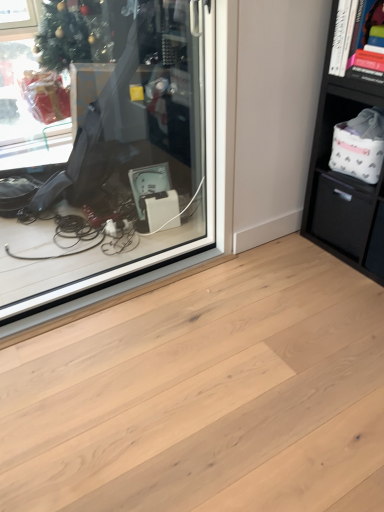
Question: Is transparent glass shop window at center at the left side of natural wood plank at center?

Choices:
 (A) no
 (B) yes

Answer: (B)

Question: Is transparent glass shop window at center not close to natural wood plank at center?

Choices:
 (A) no
 (B) yes

Answer: (A)

Question: Can you confirm if transparent glass shop window at center is positioned to the right of natural wood plank at center?

Choices:
 (A) yes
 (B) no

Answer: (B)

Question: From the image's perspective, does transparent glass shop window at center appear lower than natural wood plank at center?

Choices:
 (A) yes
 (B) no

Answer: (B)

Question: From a real-world perspective, is transparent glass shop window at center beneath natural wood plank at center?

Choices:
 (A) yes
 (B) no

Answer: (B)

Question: Considering the positions of black matte drawer at right and natural wood plank at center in the image, is black matte drawer at right bigger or smaller than natural wood plank at center?

Choices:
 (A) small
 (B) big

Answer: (A)

Question: From the image's perspective, relative to natural wood plank at center, is black matte drawer at right above or below?

Choices:
 (A) above
 (B) below

Answer: (A)

Question: Looking at their shapes, would you say black matte drawer at right is wider or thinner than natural wood plank at center?

Choices:
 (A) wide
 (B) thin

Answer: (B)

Question: Is black matte drawer at right to the left or to the right of natural wood plank at center in the image?

Choices:
 (A) right
 (B) left

Answer: (A)

Question: Does point pyautogui.click(x=370, y=74) appear closer or farther from the camera than point pyautogui.click(x=281, y=330)?

Choices:
 (A) closer
 (B) farther

Answer: (A)

Question: Considering their positions, is black matte bookshelf at upper right located in front of or behind natural wood plank at center?

Choices:
 (A) front
 (B) behind

Answer: (B)

Question: Is black matte bookshelf at upper right to the left or to the right of natural wood plank at center in the image?

Choices:
 (A) right
 (B) left

Answer: (A)

Question: Looking at their shapes, would you say black matte bookshelf at upper right is wider or thinner than natural wood plank at center?

Choices:
 (A) thin
 (B) wide

Answer: (A)

Question: Considering the positions of transparent glass shop window at center and black matte bookshelf at upper right in the image, is transparent glass shop window at center bigger or smaller than black matte bookshelf at upper right?

Choices:
 (A) big
 (B) small

Answer: (A)

Question: From the image's perspective, relative to black matte bookshelf at upper right, is transparent glass shop window at center above or below?

Choices:
 (A) above
 (B) below

Answer: (B)